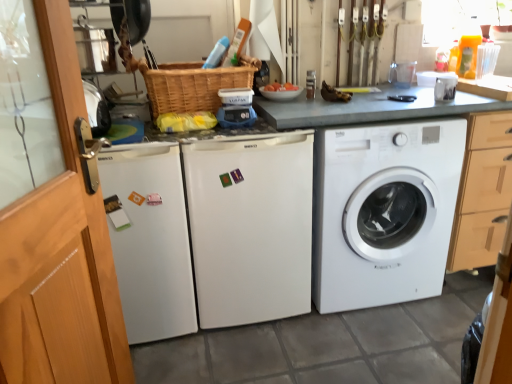
Question: Is white matte refrigerator at center, which is the 2th washing machine from right to left, in front of white matte washing machine at center, arranged as the third washing machine when viewed from the right?

Choices:
 (A) no
 (B) yes

Answer: (A)

Question: Is white matte refrigerator at center, marked as the 2th washing machine in a left-to-right arrangement, directly adjacent to white matte washing machine at center, which is the 1th washing machine in left-to-right order?

Choices:
 (A) no
 (B) yes

Answer: (A)

Question: Is white matte refrigerator at center, marked as the 2th washing machine in a left-to-right arrangement, facing towards white matte washing machine at center, arranged as the third washing machine when viewed from the right?

Choices:
 (A) yes
 (B) no

Answer: (B)

Question: Considering the relative positions of white matte refrigerator at center, which is the 2th washing machine from right to left, and white matte washing machine at center, arranged as the third washing machine when viewed from the right, in the image provided, is white matte refrigerator at center, which is the 2th washing machine from right to left, to the left of white matte washing machine at center, arranged as the third washing machine when viewed from the right, from the viewer's perspective?

Choices:
 (A) yes
 (B) no

Answer: (B)

Question: Can you confirm if white matte refrigerator at center, marked as the 2th washing machine in a left-to-right arrangement, is thinner than white matte washing machine at center, which is the 1th washing machine in left-to-right order?

Choices:
 (A) no
 (B) yes

Answer: (A)

Question: Relative to woven brown basket at center, is white matte washing machine at center, arranged as the third washing machine when viewed from the right, in front or behind?

Choices:
 (A) behind
 (B) front

Answer: (B)

Question: Considering the relative positions of white matte washing machine at center, arranged as the third washing machine when viewed from the right, and woven brown basket at center in the image provided, is white matte washing machine at center, arranged as the third washing machine when viewed from the right, to the left or to the right of woven brown basket at center?

Choices:
 (A) left
 (B) right

Answer: (A)

Question: From a real-world perspective, is white matte washing machine at center, arranged as the third washing machine when viewed from the right, positioned above or below woven brown basket at center?

Choices:
 (A) below
 (B) above

Answer: (A)

Question: In terms of width, does white matte washing machine at center, arranged as the third washing machine when viewed from the right, look wider or thinner when compared to woven brown basket at center?

Choices:
 (A) thin
 (B) wide

Answer: (B)

Question: Is transparent glass screen door at left, which is the 1th screen door in right-to-left order, spatially inside wooden screen door at left, placed as the 2th screen door when sorted from right to left, or outside of it?

Choices:
 (A) outside
 (B) inside

Answer: (A)

Question: In terms of height, does transparent glass screen door at left, which is the 1th screen door in right-to-left order, look taller or shorter compared to wooden screen door at left, placed as the 2th screen door when sorted from right to left?

Choices:
 (A) tall
 (B) short

Answer: (A)

Question: Considering the positions of point (35, 274) and point (8, 253), is point (35, 274) closer or farther from the camera than point (8, 253)?

Choices:
 (A) closer
 (B) farther

Answer: (B)

Question: Looking at the image, does transparent glass screen door at left, which is the 1th screen door in right-to-left order, seem bigger or smaller compared to wooden screen door at left, acting as the first screen door starting from the left?

Choices:
 (A) small
 (B) big

Answer: (B)

Question: Looking at their shapes, would you say white matte washing machine at center, arranged as the third washing machine when viewed from the right, is wider or thinner than white matte refrigerator at center, marked as the 2th washing machine in a left-to-right arrangement?

Choices:
 (A) wide
 (B) thin

Answer: (B)

Question: Based on their positions, is white matte washing machine at center, which is the 1th washing machine in left-to-right order, located to the left or right of white matte refrigerator at center, marked as the 2th washing machine in a left-to-right arrangement?

Choices:
 (A) left
 (B) right

Answer: (A)